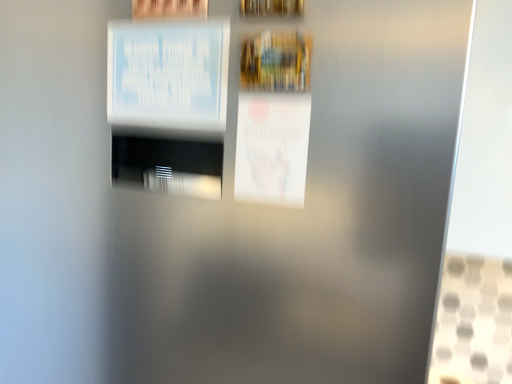
Question: Is point (295, 11) positioned closer to the camera than point (131, 36)?

Choices:
 (A) closer
 (B) farther

Answer: (A)

Question: Is wooden picture frame at upper center to the left or to the right of white paper at upper left, which is the second poster from right to left, in the image?

Choices:
 (A) left
 (B) right

Answer: (B)

Question: Which object is positioned closest to the white paper poster at center, marked as the 1th poster in a bottom-to-top arrangement?

Choices:
 (A) white paper at upper left, arranged as the second poster when ordered from the bottom
 (B) wooden picture frame at upper center

Answer: (A)

Question: Estimate the real-world distances between objects in this image. Which object is closer to the wooden picture frame at upper center?

Choices:
 (A) white paper at upper left, arranged as the second poster when ordered from the bottom
 (B) white paper poster at center, marked as the 1th poster in a bottom-to-top arrangement

Answer: (A)